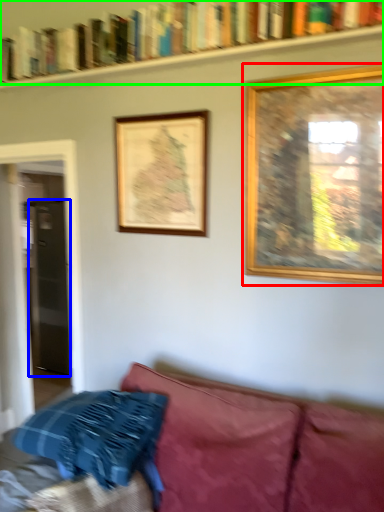
Question: Considering the real-world distances, which object is closest to picture frame (highlighted by a red box)? glass door (highlighted by a blue box) or book (highlighted by a green box).

Choices:
 (A) glass door
 (B) book

Answer: (B)